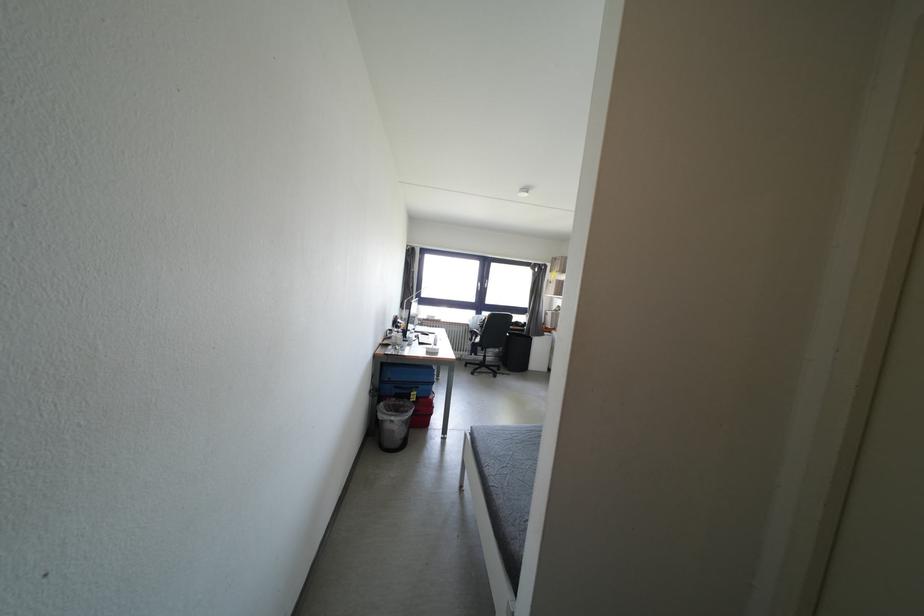
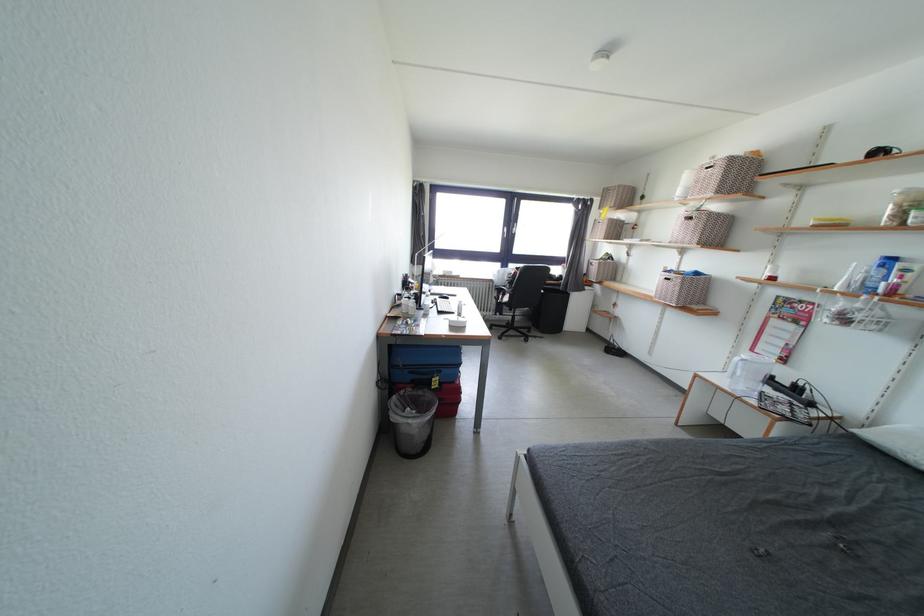
Locate, in the second image, the point that corresponds to the point at 487,318 in the first image.

(514, 270)